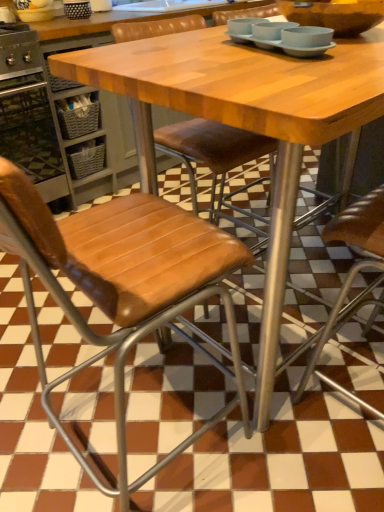
You are a GUI agent. You are given a task and a screenshot of the screen. Output one action in this format:
    pyautogui.click(x=<x>, y=<y>)
    Task: Click on the brushed metal oven at left
    
    Given the screenshot: What is the action you would take?
    pyautogui.click(x=31, y=116)

What is the approximate height of wooden table at center?

wooden table at center is 98.99 centimeters tall.

The image size is (384, 512). What do you see at coordinates (336, 15) in the screenshot?
I see `matte brown bowl at upper center` at bounding box center [336, 15].

In order to face light blue matte bowls at upper center, should I rotate leftwards or rightwards?

A 11.168 degree turn to the right will do.

Find the location of `brown leather chair at center, the 1th chair when ordered from right to left`. brown leather chair at center, the 1th chair when ordered from right to left is located at coordinates (122, 287).

Does wooden table at center have a lesser width compared to brown leather chair at center, placed as the 1th chair when sorted from left to right?

Yes, wooden table at center is thinner than brown leather chair at center, placed as the 1th chair when sorted from left to right.

Between point (317, 101) and point (217, 138), which one is positioned in front?

The point (317, 101) is in front.

Does wooden table at center have a smaller size compared to brown leather chair at center, placed as the 1th chair when sorted from left to right?

Actually, wooden table at center might be larger than brown leather chair at center, placed as the 1th chair when sorted from left to right.

Are wooden table at center and brown leather chair at center, which is the 2th chair from right to left, beside each other?

No, wooden table at center is not touching brown leather chair at center, which is the 2th chair from right to left.

In the image, there is a light blue matte bowls at upper center. Find the location of `table below it (from a real-world perspective)`. table below it (from a real-world perspective) is located at coordinates (244, 122).

Considering the relative sizes of wooden table at center and light blue matte bowls at upper center in the image provided, is wooden table at center taller than light blue matte bowls at upper center?

Indeed, wooden table at center has a greater height compared to light blue matte bowls at upper center.

Is wooden table at center in front of or behind light blue matte bowls at upper center in the image?

In the image, wooden table at center appears in front of light blue matte bowls at upper center.

What's the angular difference between brushed metal oven at left and wooden table at center's facing directions?

87.7 degrees.

Could you tell me if brushed metal oven at left is turned towards wooden table at center?

Yes, brushed metal oven at left is oriented towards wooden table at center.

Who is taller, brushed metal oven at left or wooden table at center?

wooden table at center is taller.

Is point (304, 38) positioned behind point (269, 286)?

No.

Find the location of `table in front of the light blue matte bowls at upper center`. table in front of the light blue matte bowls at upper center is located at coordinates (244, 122).

Is light blue matte bowls at upper center inside or outside of wooden table at center?

light blue matte bowls at upper center is spatially situated outside wooden table at center.

Is light blue matte bowls at upper center beside wooden table at center?

No, light blue matte bowls at upper center is not next to wooden table at center.

Considering the relative sizes of matte brown bowl at upper center and brushed metal oven at left in the image provided, is matte brown bowl at upper center bigger than brushed metal oven at left?

No.

From a real-world perspective, who is located lower, matte brown bowl at upper center or brushed metal oven at left?

brushed metal oven at left, from a real-world perspective.

Could you tell me if matte brown bowl at upper center is facing brushed metal oven at left?

No, matte brown bowl at upper center is not turned towards brushed metal oven at left.

Based on the photo, from the image's perspective, is matte brown bowl at upper center below brushed metal oven at left?

Indeed, from the image's perspective, matte brown bowl at upper center is shown beneath brushed metal oven at left.

From a real-world perspective, is light blue matte bowls at upper center physically above brown leather chair at center, which is the 2th chair from right to left?

Yes.

Is light blue matte bowls at upper center with brown leather chair at center, placed as the 1th chair when sorted from left to right?

They are not placed beside each other.

Does light blue matte bowls at upper center have a lesser width compared to brown leather chair at center, which is the 2th chair from right to left?

Indeed, light blue matte bowls at upper center has a lesser width compared to brown leather chair at center, which is the 2th chair from right to left.

Measure the distance between light blue matte bowls at upper center and brown leather chair at center, placed as the 1th chair when sorted from left to right.

They are 3.83 feet apart.

Does light blue matte bowls at upper center have a smaller size compared to brown leather chair at center, which ranks as the 2th chair in left-to-right order?

Yes, light blue matte bowls at upper center is smaller than brown leather chair at center, which ranks as the 2th chair in left-to-right order.

Is light blue matte bowls at upper center taller or shorter than brown leather chair at center, which ranks as the 2th chair in left-to-right order?

light blue matte bowls at upper center is shorter than brown leather chair at center, which ranks as the 2th chair in left-to-right order.

Identify the location of table located in front of the brown leather chair at center, which is the 2th chair from right to left. The image size is (384, 512). (244, 122).

Locate an element on the screen. The height and width of the screenshot is (512, 384). table located on the left of light blue matte bowls at upper center is located at coordinates (244, 122).

Based on their spatial positions, is brushed metal oven at left or light blue matte bowls at upper center closer to wooden table at center?

light blue matte bowls at upper center is closer to wooden table at center.

Consider the image. Which object lies nearer to the anchor point matte brown bowl at upper center, brown leather chair at center, which ranks as the 2th chair in left-to-right order, or light blue matte bowls at upper center?

light blue matte bowls at upper center.

Estimate the real-world distances between objects in this image. Which object is further from brushed metal oven at left, matte brown bowl at upper center or light blue matte bowls at upper center?

matte brown bowl at upper center is further to brushed metal oven at left.

Consider the image. When comparing their distances from wooden table at center, does brown leather chair at center, placed as the 1th chair when sorted from left to right, or brushed metal oven at left seem further?

Based on the image, brushed metal oven at left appears to be further to wooden table at center.

When comparing their distances from brown leather chair at center, which ranks as the 2th chair in left-to-right order, does light blue matte bowls at upper center or matte brown bowl at upper center seem further?

matte brown bowl at upper center lies further to brown leather chair at center, which ranks as the 2th chair in left-to-right order, than the other object.

Estimate the real-world distances between objects in this image. Which object is closer to light blue matte bowls at upper center, brushed metal oven at left or wooden table at center?

Among the two, wooden table at center is located nearer to light blue matte bowls at upper center.

Which object lies further to the anchor point matte brown bowl at upper center, wooden table at center or brown leather chair at center, which is the 2th chair from right to left?

The object further to matte brown bowl at upper center is brown leather chair at center, which is the 2th chair from right to left.

From the image, which object appears to be nearer to brown leather chair at center, which ranks as the 2th chair in left-to-right order, wooden table at center or brown leather chair at center, which is the 2th chair from right to left?

wooden table at center is closer to brown leather chair at center, which ranks as the 2th chair in left-to-right order.

The image size is (384, 512). What are the coordinates of `tableware between brushed metal oven at left and matte brown bowl at upper center from left to right` in the screenshot? It's located at [x=281, y=36].

Where is `tableware between brown leather chair at center, which is the 2th chair from right to left, and matte brown bowl at upper center from left to right`? tableware between brown leather chair at center, which is the 2th chair from right to left, and matte brown bowl at upper center from left to right is located at coordinates (281, 36).

Find the location of `tableware between matte brown bowl at upper center and wooden table at center in the up-down direction`. tableware between matte brown bowl at upper center and wooden table at center in the up-down direction is located at coordinates (281, 36).

I want to click on chair positioned between wooden table at center and brown leather chair at center, placed as the 1th chair when sorted from left to right, from near to far, so click(x=122, y=287).